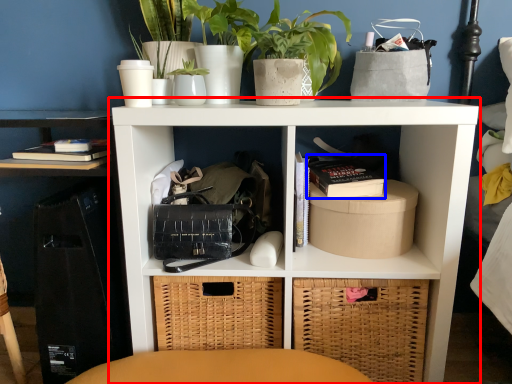
Question: Which of the following is the closest to the observer, shelf (highlighted by a red box) or book (highlighted by a blue box)?

Choices:
 (A) shelf
 (B) book

Answer: (A)